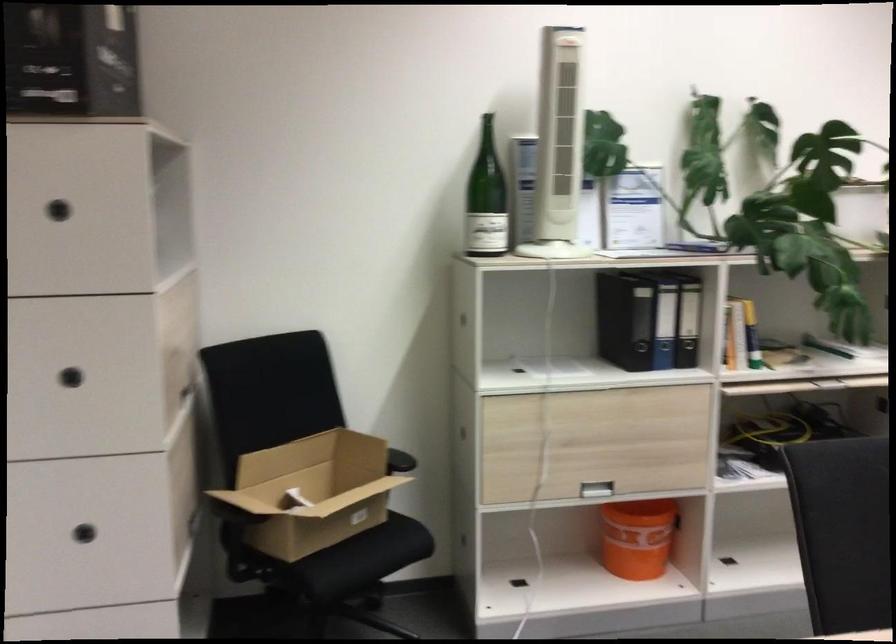
Which object does [312,491] point to?

It corresponds to the open cardboard box in the image.